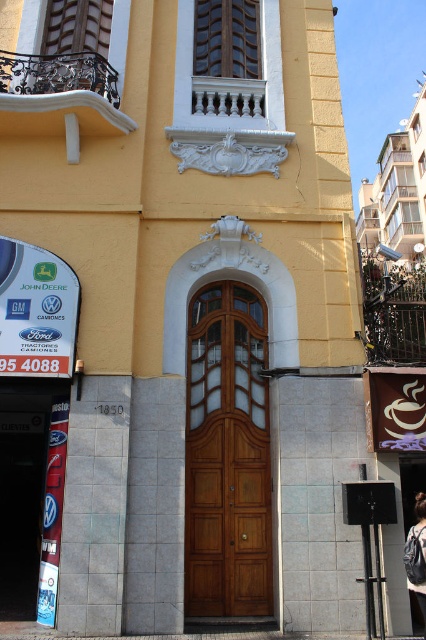
From the picture: Between wooden door at center and denim jacket at lower right, which one has more height?

Standing taller between the two is wooden door at center.

Which is in front, point (201, 381) or point (419, 572)?

Positioned in front is point (419, 572).

Describe the element at coordinates (227, 456) in the screenshot. This screenshot has width=426, height=640. I see `wooden door at center` at that location.

This screenshot has height=640, width=426. In order to click on wooden door at center in this screenshot , I will do `click(227, 456)`.